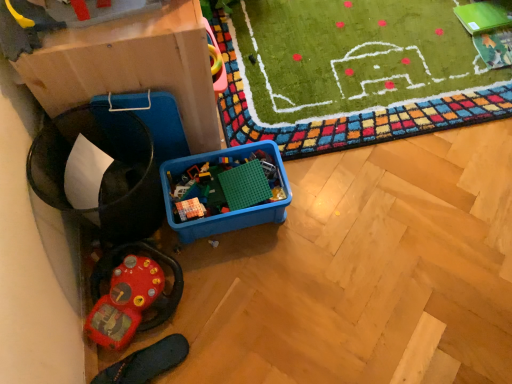
Question: From a real-world perspective, is matte cardboard box at left above or below black rubber slipper at lower left?

Choices:
 (A) above
 (B) below

Answer: (A)

Question: Is matte cardboard box at left inside the boundaries of black rubber slipper at lower left, or outside?

Choices:
 (A) inside
 (B) outside

Answer: (B)

Question: Based on their relative distances, which object is farther from the black rubber slipper at lower left?

Choices:
 (A) rubberized red steering wheel at lower left, arranged as the 2th toy when viewed from the top
 (B) blue plastic container at center, which ranks as the 2th toy in left-to-right order
 (C) matte cardboard box at left

Answer: (C)

Question: Which is nearer to the rubberized red steering wheel at lower left, arranged as the 2th toy when viewed from the top?

Choices:
 (A) matte cardboard box at left
 (B) blue plastic container at center, the 1th toy in the top-to-bottom sequence
 (C) black rubber slipper at lower left

Answer: (C)